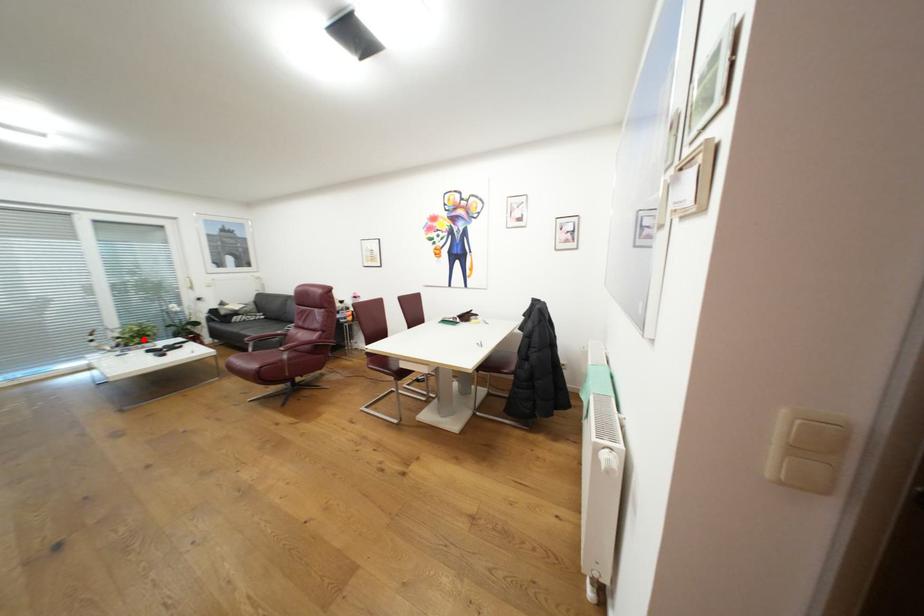
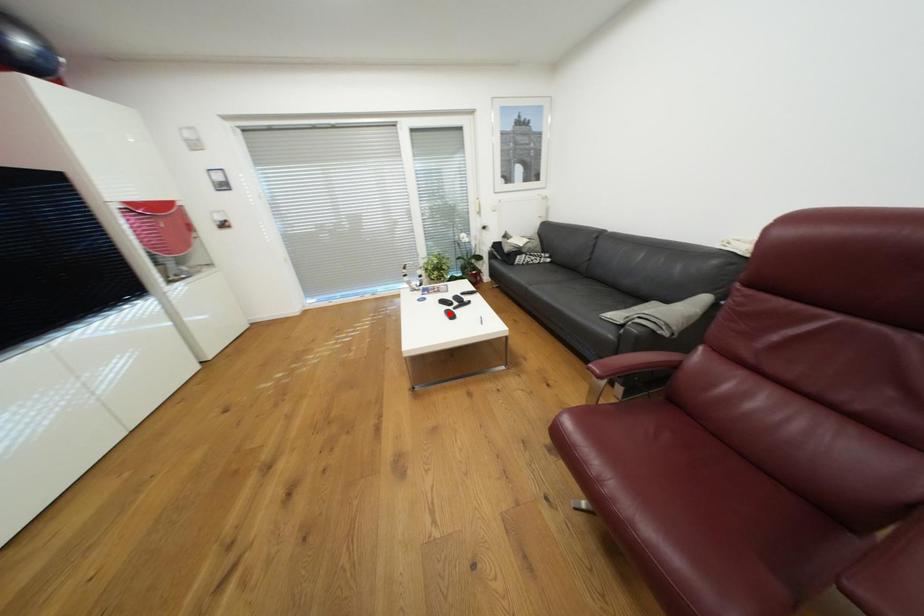
I am providing you with two images of the same scene from different viewpoints. A red point is marked on the first image and another point is marked on the second image. Is the red point in image1 aligned with the point shown in image2?

No